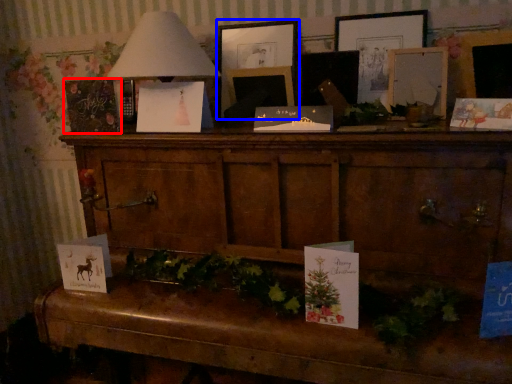
Question: Which object appears farthest to the camera in this image, christmas card (highlighted by a red box) or picture frame (highlighted by a blue box)?

Choices:
 (A) christmas card
 (B) picture frame

Answer: (B)